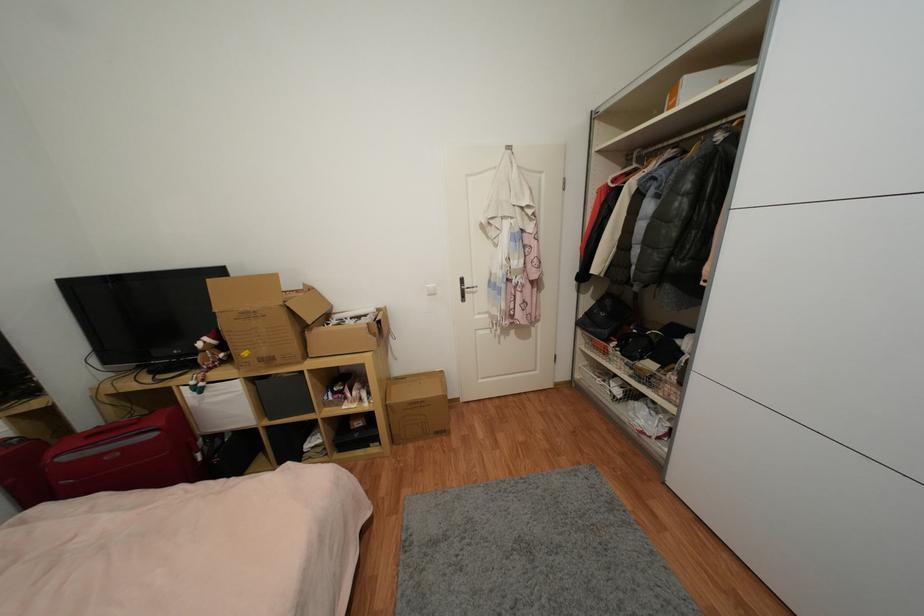
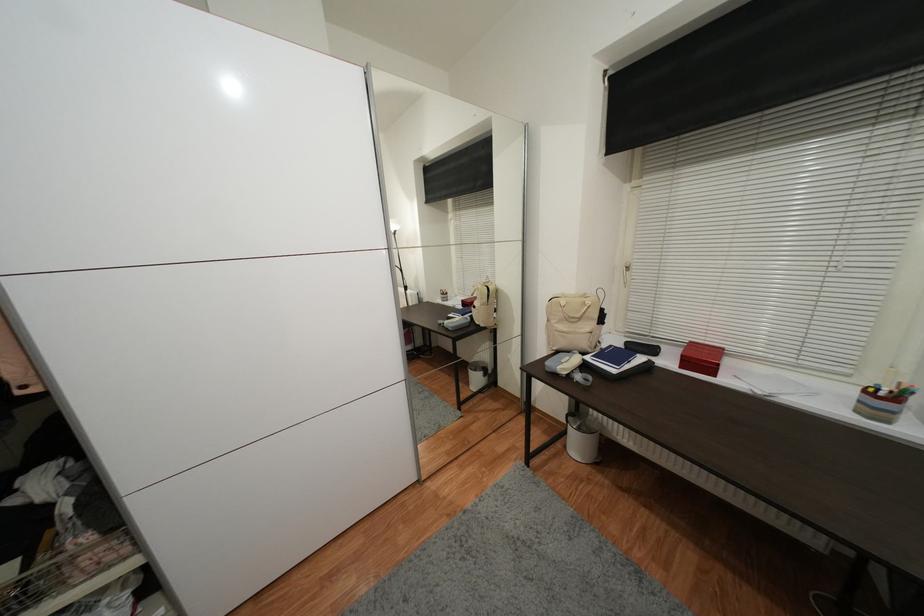
First-person continuous shooting, in which direction is the camera rotating?

The camera rotated toward right-down.